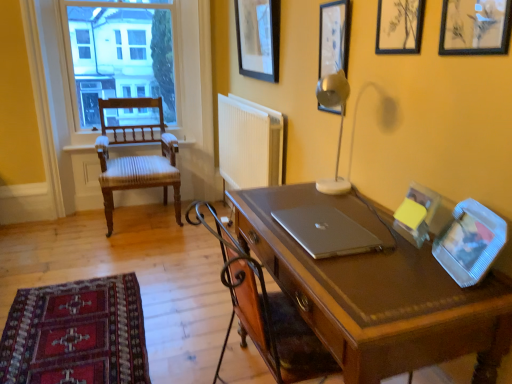
I want to click on vacant space that's between clear plastic picture frame at right, which is the 4th picture frame in left-to-right order, and silver metallic laptop at center, so [x=394, y=256].